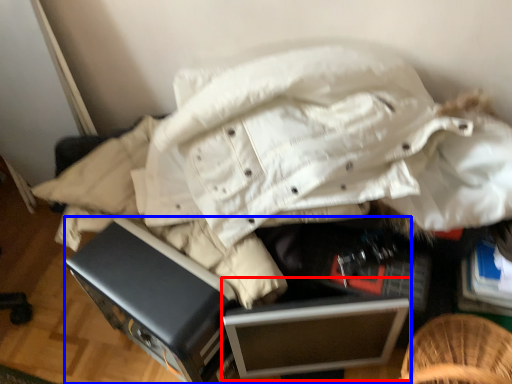
Question: Which of the following is the closest to the observer, file cabinet (highlighted by a red box) or furniture (highlighted by a blue box)?

Choices:
 (A) file cabinet
 (B) furniture

Answer: (B)